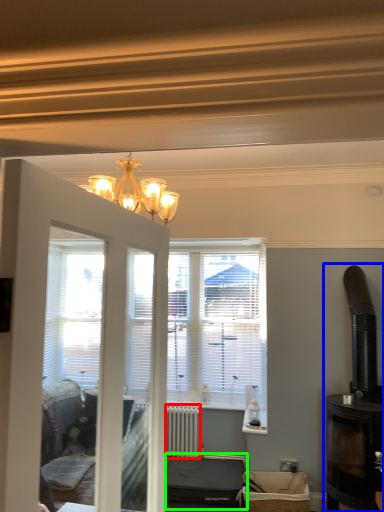
Question: Based on their relative distances, which object is farther from radiator (highlighted by a red box)? Choose from fireplace (highlighted by a blue box) and furniture (highlighted by a green box).

Choices:
 (A) fireplace
 (B) furniture

Answer: (A)